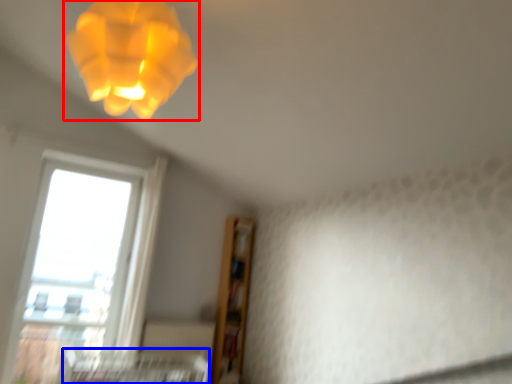
Question: Which object is further to the camera taking this photo, lamp (highlighted by a red box) or bed frame (highlighted by a blue box)?

Choices:
 (A) lamp
 (B) bed frame

Answer: (B)